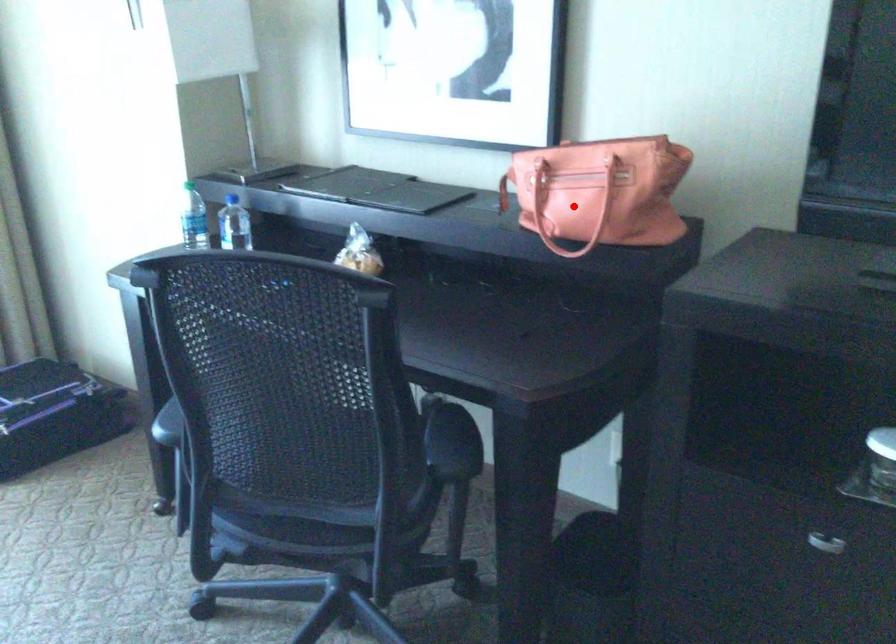
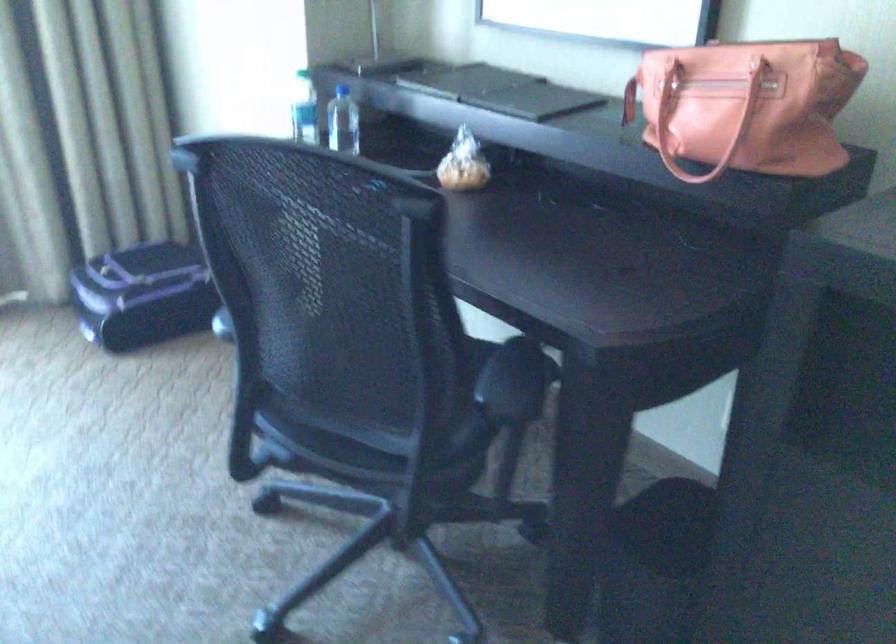
Locate, in the second image, the point that corresponds to the highlighted location in the first image.

(704, 122)